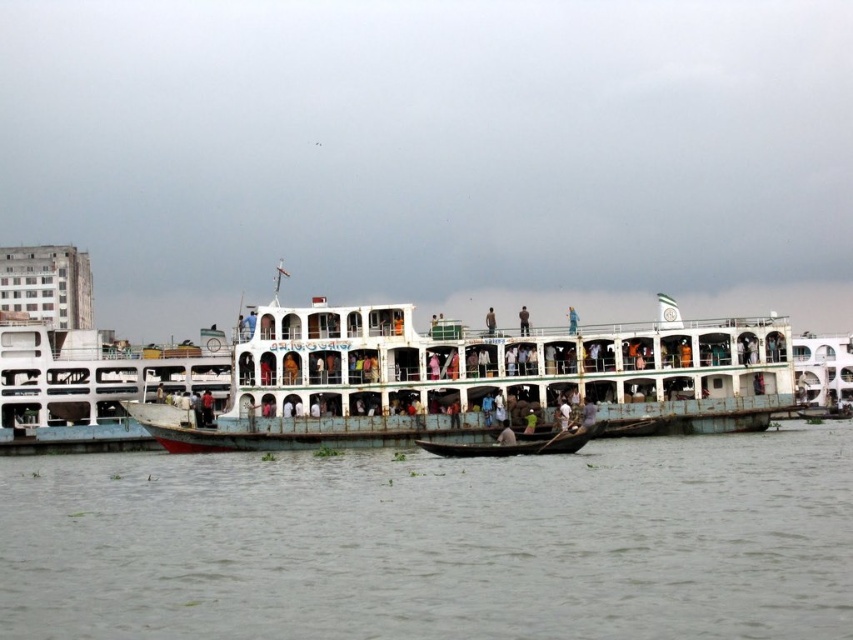
You are navigating a small boat and need to pass through a narrow channel between two points. The white painted metal ferry at center is positioned at coordinates approximately 0.591 on the x and 0.563 on the y axis. Can you safely navigate around it without collision?

The white painted metal ferry at center is located at point (479, 378). Since the ferry is stationary and you can adjust your course, you can safely navigate around it by choosing a path that avoids its coordinates, ensuring no collision occurs.

You are a passenger on the ferry and want to move from the grayish water at center to the light blue fabric shirt at center. Which direction should you move?

The grayish water at center is to the left of the light blue fabric shirt at center, so you should move to the right to reach it.